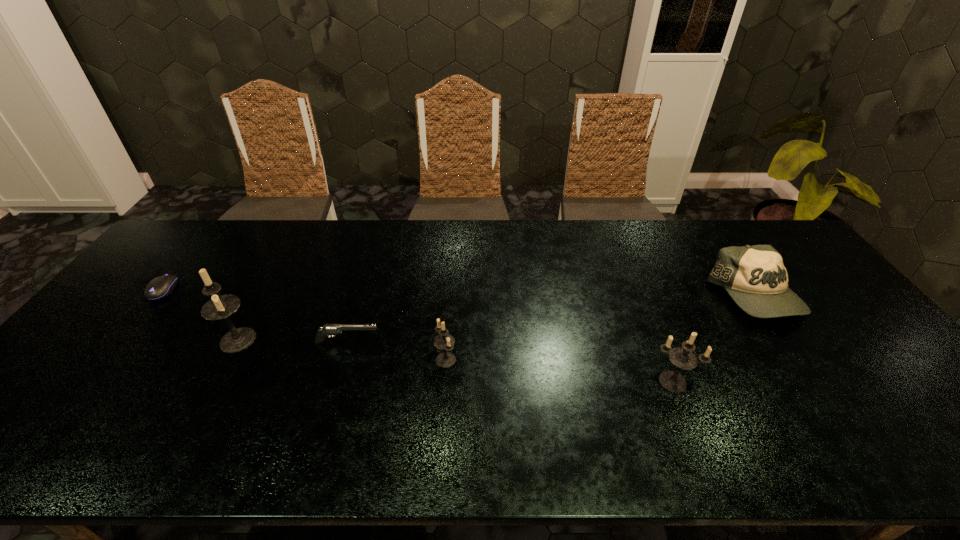
Given the evenly spaced candle holders in the image, where should an extra candle holder be added on the right to preserve the spacing? Please point to a vacant space. Please provide its 2D coordinates. Your answer should be formatted as a tuple, i.e. [(x, y)], where the tuple contains the x and y coordinates of a point satisfying the conditions above.

[(922, 405)]